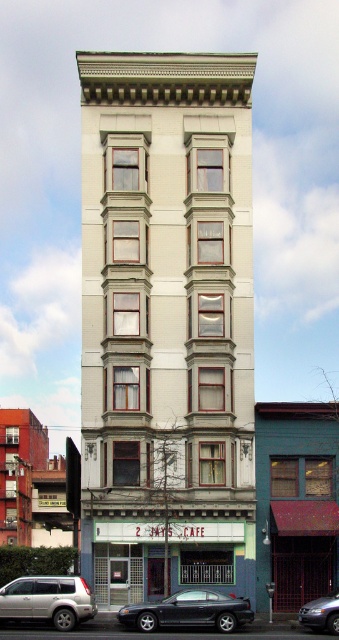
Question: Which point is closer to the camera?

Choices:
 (A) silver metallic suv at lower left
 (B) shiny black sedan at lower center

Answer: (A)

Question: Is silver metallic suv at lower left thinner than metallic silver sedan at lower right?

Choices:
 (A) yes
 (B) no

Answer: (B)

Question: Among these objects, which one is nearest to the camera?

Choices:
 (A) silver metallic suv at lower left
 (B) metallic silver sedan at lower right
 (C) shiny black sedan at lower center

Answer: (A)

Question: Does silver metallic suv at lower left come behind metallic silver sedan at lower right?

Choices:
 (A) yes
 (B) no

Answer: (B)

Question: Does shiny black sedan at lower center come behind metallic silver sedan at lower right?

Choices:
 (A) yes
 (B) no

Answer: (B)

Question: Which of the following is the farthest from the observer?

Choices:
 (A) (232, 628)
 (B) (331, 596)

Answer: (B)